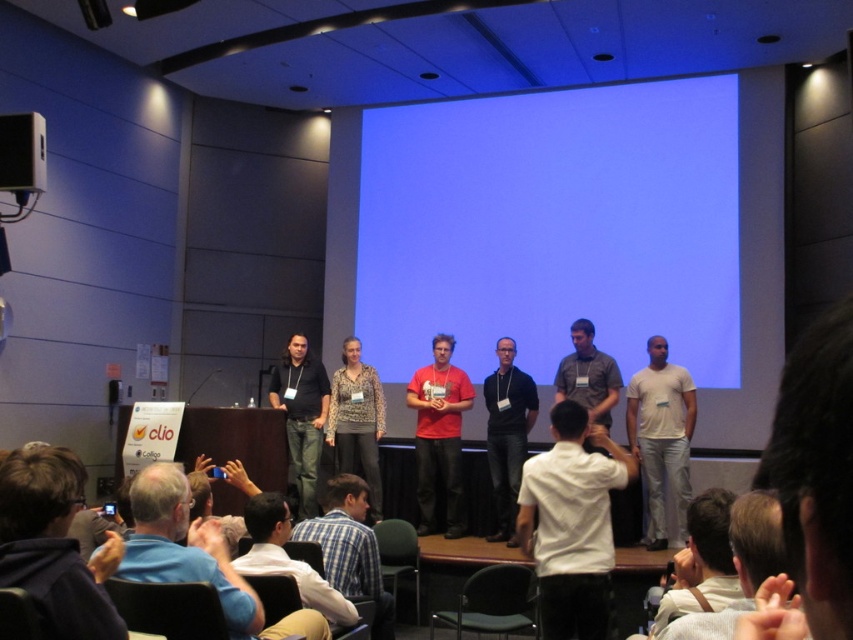
This screenshot has width=853, height=640. I want to click on blue shirt at lower left, so click(196, 556).

Which is below, blue shirt at lower left or light brown leather jacket at lower right?

blue shirt at lower left

Is point (183, 518) behind point (752, 586)?

Yes, point (183, 518) is behind point (752, 586).

Where is `blue shirt at lower left`? This screenshot has width=853, height=640. blue shirt at lower left is located at coordinates (196, 556).

Does blue plaid shirt at lower center lie behind light brown leather jacket at lower right?

Yes, it is behind light brown leather jacket at lower right.

How far apart are blue plaid shirt at lower center and light brown leather jacket at lower right?

They are 7.04 feet apart.

What do you see at coordinates (350, 548) in the screenshot? This screenshot has width=853, height=640. I see `blue plaid shirt at lower center` at bounding box center [350, 548].

Locate an element on the screen. The height and width of the screenshot is (640, 853). blue plaid shirt at lower center is located at coordinates (350, 548).

Is blue matte projection screen at upper center closer to camera compared to gray shirt at center?

No, blue matte projection screen at upper center is behind gray shirt at center.

What do you see at coordinates (553, 227) in the screenshot? I see `blue matte projection screen at upper center` at bounding box center [553, 227].

Who is more forward, (x=526, y=211) or (x=595, y=364)?

Point (x=595, y=364)

The width and height of the screenshot is (853, 640). In order to click on blue matte projection screen at upper center in this screenshot , I will do `click(553, 227)`.